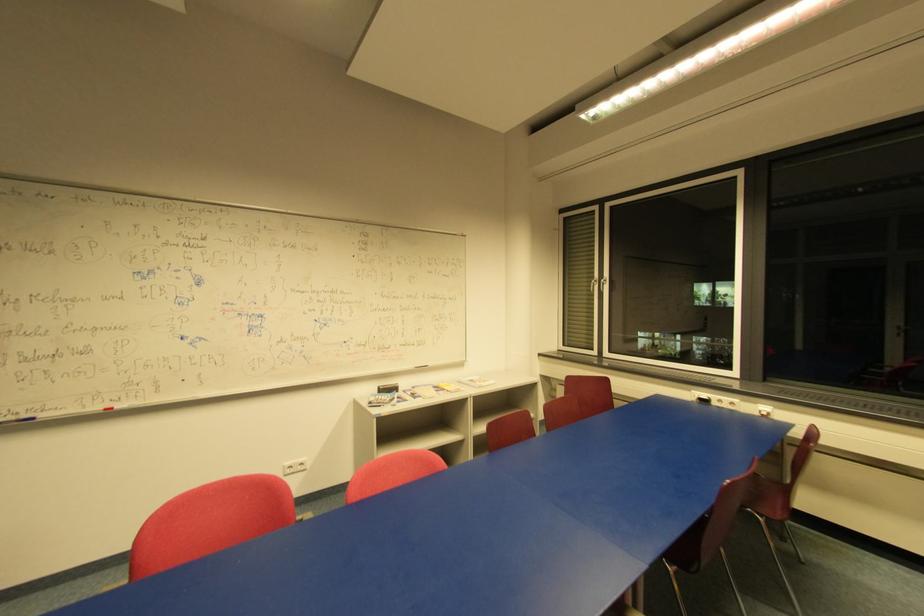
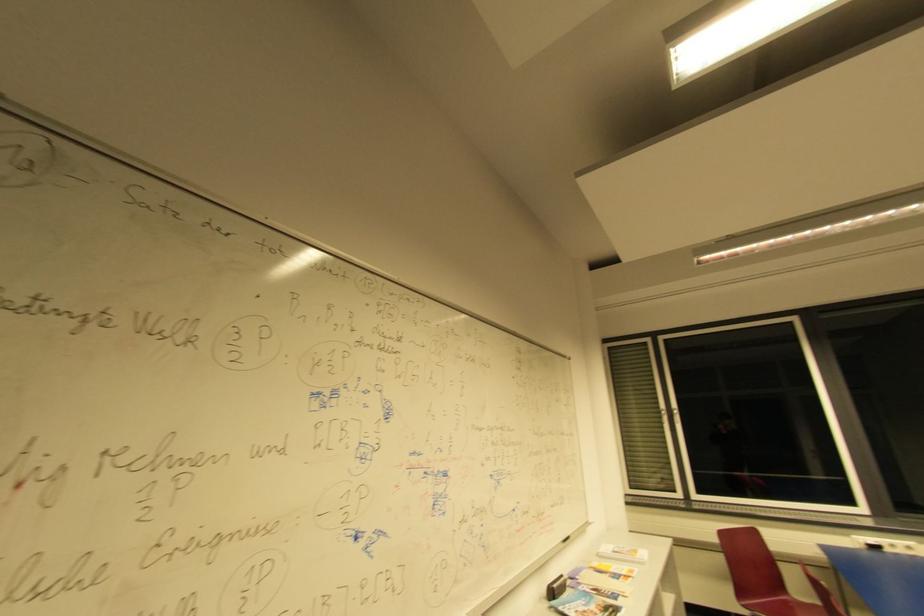
The point at (x=488, y=383) is marked in the first image. Where is the corresponding point in the second image?

(640, 553)